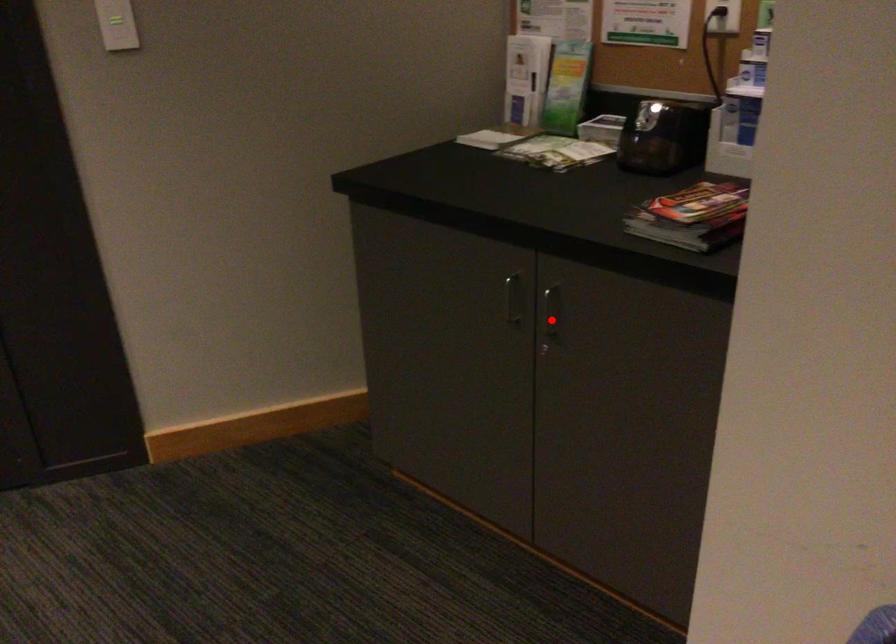
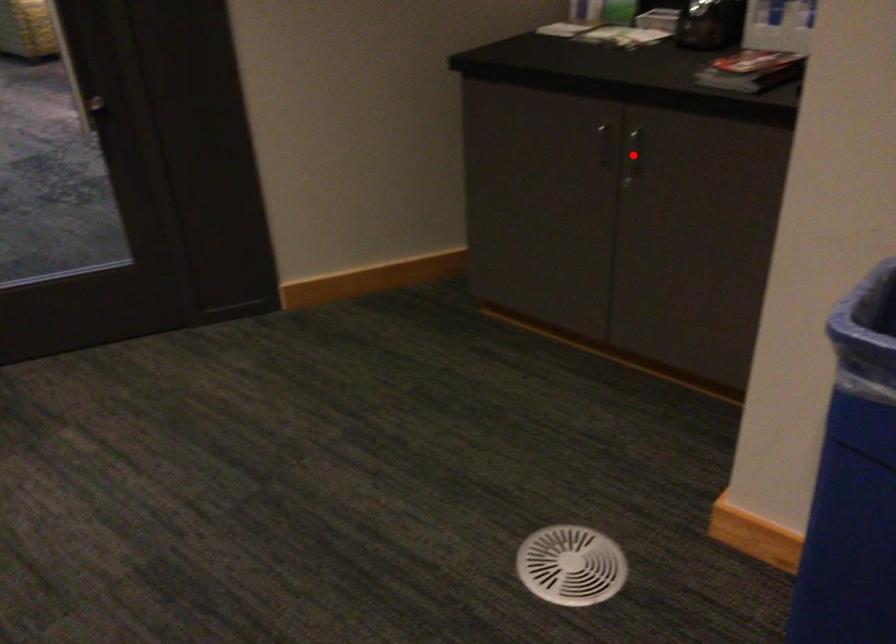
I am providing you with two images of the same scene from different viewpoints. A red point is marked on the first image and another point is marked on the second image. Are the points marked in image1 and image2 representing the same 3D position?

Yes